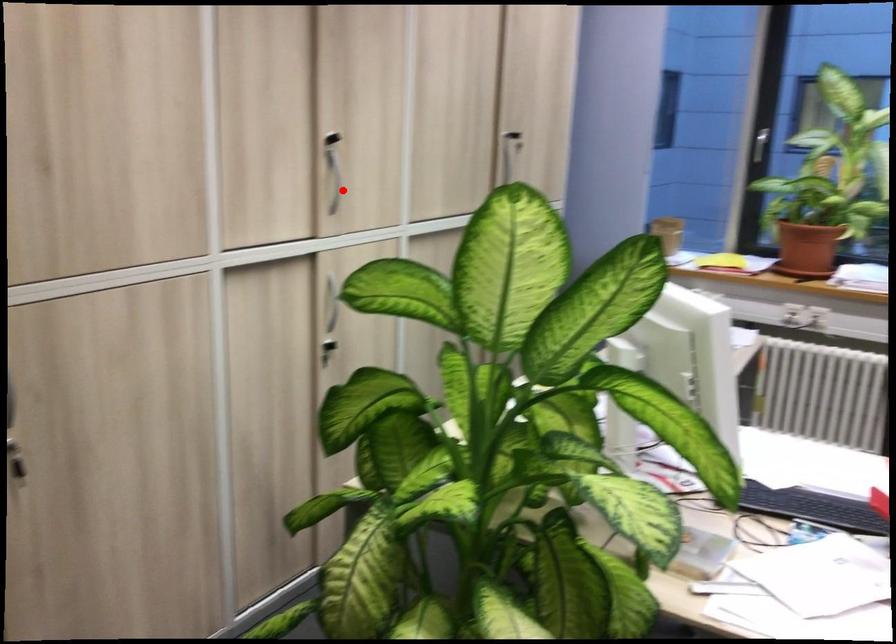
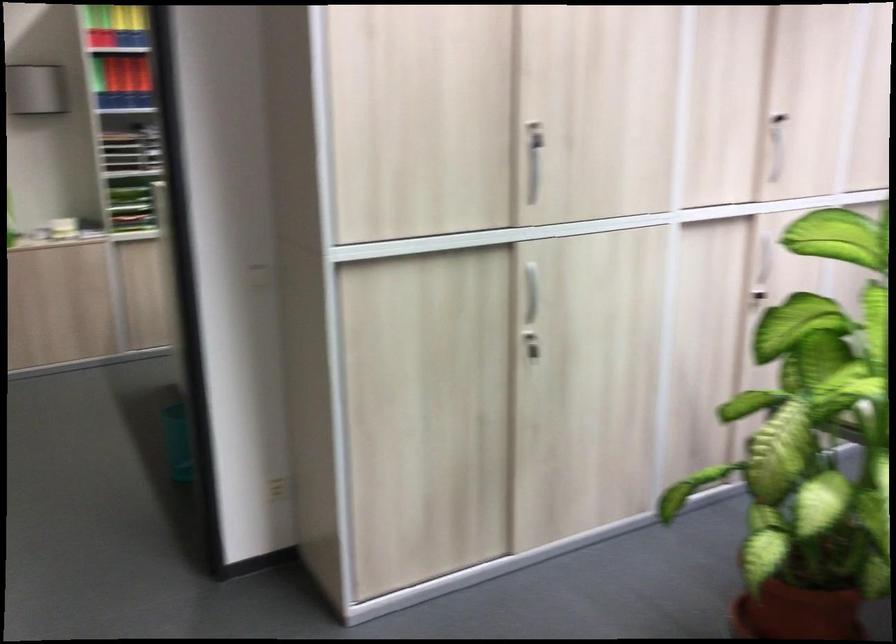
Where in the second image is the point corresponding to the highlighted location from the first image?

(779, 166)